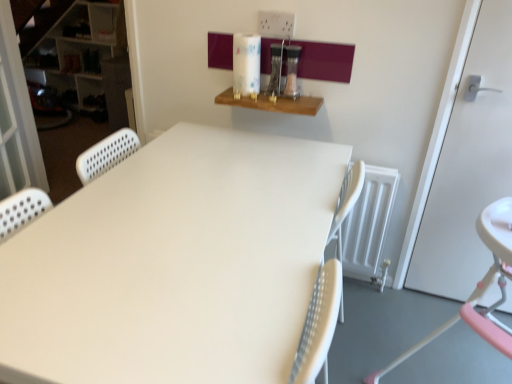
Question: Is white perforated screen door at left in front of pink plastic highchair at lower right?

Choices:
 (A) no
 (B) yes

Answer: (A)

Question: Does white perforated screen door at left turn towards pink plastic highchair at lower right?

Choices:
 (A) no
 (B) yes

Answer: (A)

Question: Can you confirm if white perforated screen door at left is positioned to the left of pink plastic highchair at lower right?

Choices:
 (A) no
 (B) yes

Answer: (B)

Question: Is white perforated screen door at left in contact with pink plastic highchair at lower right?

Choices:
 (A) yes
 (B) no

Answer: (B)

Question: Considering the relative sizes of white perforated screen door at left and pink plastic highchair at lower right in the image provided, is white perforated screen door at left shorter than pink plastic highchair at lower right?

Choices:
 (A) no
 (B) yes

Answer: (A)

Question: From their relative heights in the image, would you say wooden shelf at upper center is taller or shorter than white perforated screen door at left?

Choices:
 (A) short
 (B) tall

Answer: (A)

Question: In terms of size, does wooden shelf at upper center appear bigger or smaller than white perforated screen door at left?

Choices:
 (A) big
 (B) small

Answer: (B)

Question: From a real-world perspective, is wooden shelf at upper center physically located above or below white perforated screen door at left?

Choices:
 (A) above
 (B) below

Answer: (A)

Question: Relative to white perforated screen door at left, is wooden shelf at upper center in front or behind?

Choices:
 (A) front
 (B) behind

Answer: (B)

Question: Based on their positions, is pink plastic highchair at lower right located to the left or right of white matte door at right?

Choices:
 (A) right
 (B) left

Answer: (B)

Question: In terms of width, does pink plastic highchair at lower right look wider or thinner when compared to white matte door at right?

Choices:
 (A) wide
 (B) thin

Answer: (A)

Question: From the image's perspective, is pink plastic highchair at lower right positioned above or below white matte door at right?

Choices:
 (A) above
 (B) below

Answer: (B)

Question: Do you think pink plastic highchair at lower right is within white matte door at right, or outside of it?

Choices:
 (A) outside
 (B) inside

Answer: (A)

Question: Does point [82, 359] appear closer or farther from the camera than point [507, 248]?

Choices:
 (A) closer
 (B) farther

Answer: (A)

Question: Is white matte table at center to the left or to the right of pink plastic highchair at lower right in the image?

Choices:
 (A) right
 (B) left

Answer: (B)